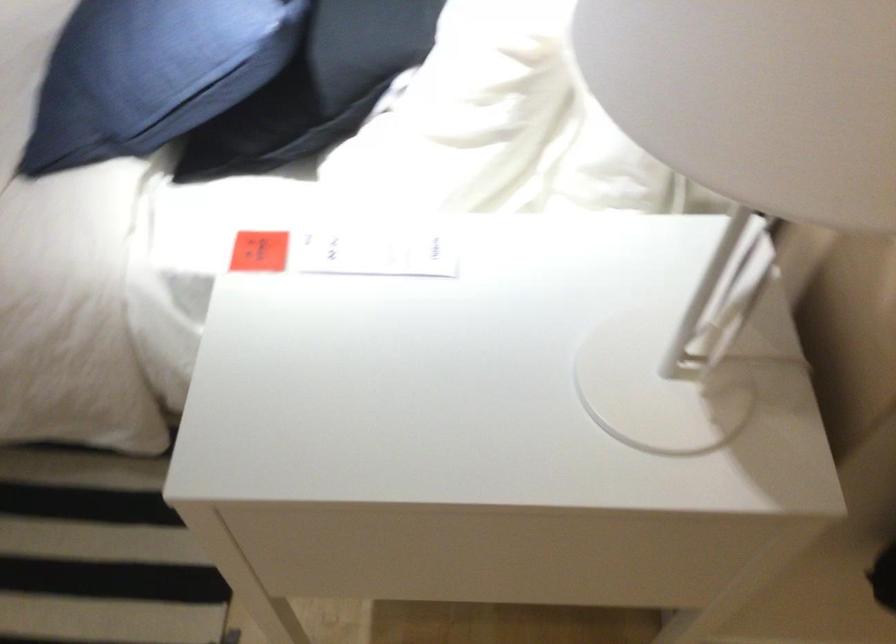
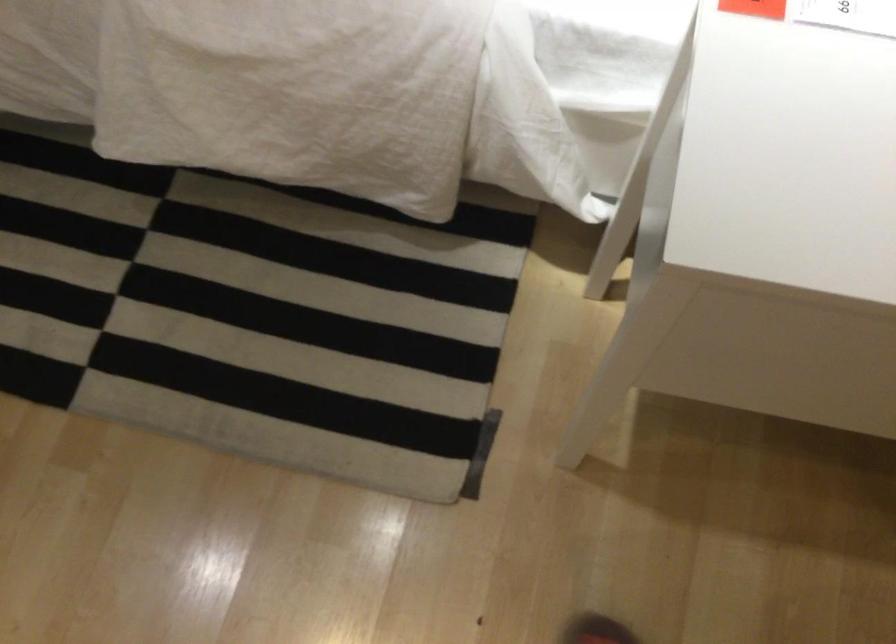
Question: The images are taken continuously from a first-person perspective. In which direction are you moving?

Choices:
 (A) Left
 (B) Right
 (C) Forward
 (D) Backward

Answer: (A)